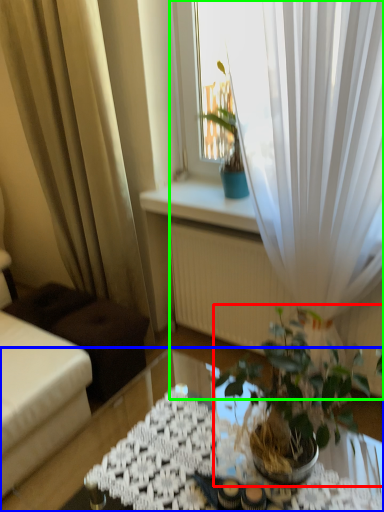
Question: Which object is the closest to the houseplant (highlighted by a red box)? Choose among these: table (highlighted by a blue box) or curtain (highlighted by a green box).

Choices:
 (A) table
 (B) curtain

Answer: (B)